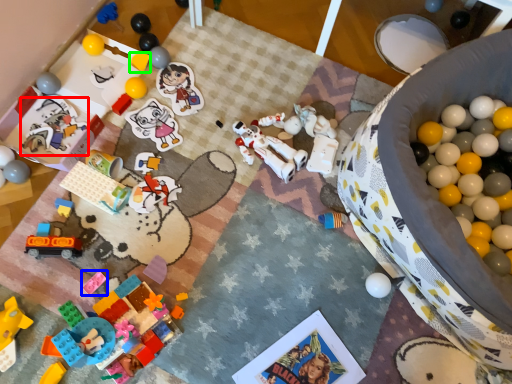
Question: Which object is the closest to the toy (highlighted by a red box)? Choose among these: toy (highlighted by a blue box) or toy (highlighted by a green box).

Choices:
 (A) toy
 (B) toy

Answer: (B)